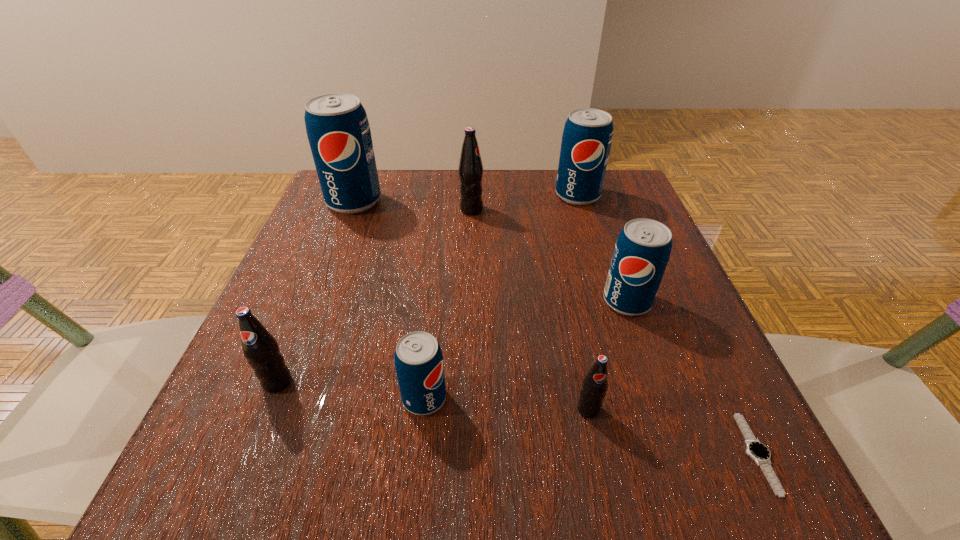
What are the coordinates of `vacant space located 0.150m on the back of the third blue pop from right to left` in the screenshot? It's located at (434, 308).

Locate an element on the screen. The height and width of the screenshot is (540, 960). free space located 0.090m on the front label of the smallest black pop is located at coordinates (604, 484).

Image resolution: width=960 pixels, height=540 pixels. Find the location of `free space located 0.190m on the back of the watch`. free space located 0.190m on the back of the watch is located at coordinates (690, 316).

What are the coordinates of `object located in the near edge section of the desktop` in the screenshot? It's located at (760, 453).

The width and height of the screenshot is (960, 540). I want to click on watch at the right edge, so click(760, 453).

This screenshot has width=960, height=540. In order to click on object that is at the far left corner in this screenshot , I will do `click(338, 131)`.

I want to click on object that is at the far right corner, so click(587, 136).

Where is `object located at the near right corner`? object located at the near right corner is located at coordinates (760, 453).

What are the coordinates of `free space at the far edge of the desktop` in the screenshot? It's located at (415, 214).

Find the location of `free point at the left edge`. free point at the left edge is located at coordinates (238, 383).